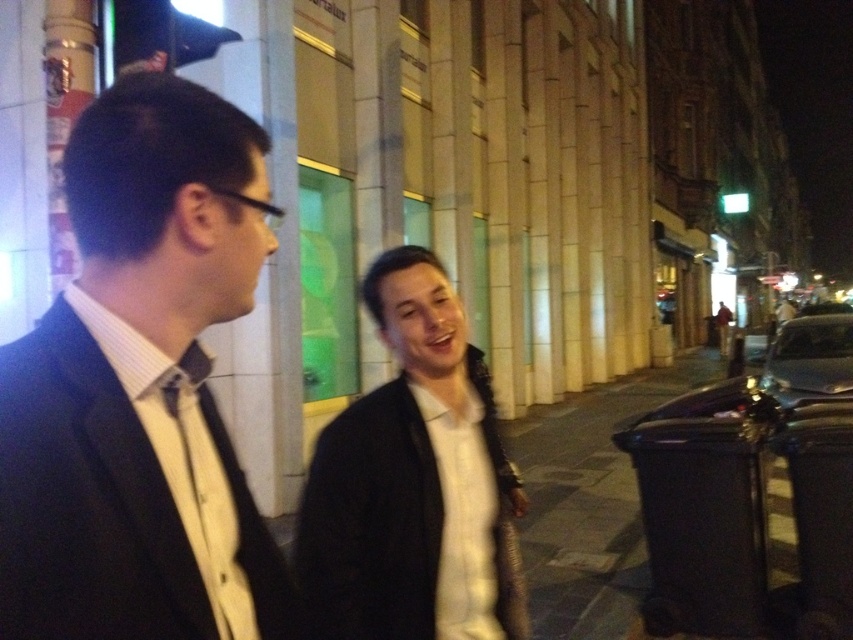
Can you confirm if black matte suit at left is thinner than matte black bow tie at center?

No, black matte suit at left is not thinner than matte black bow tie at center.

Is black matte suit at left to the left of matte black bow tie at center from the viewer's perspective?

Indeed, black matte suit at left is positioned on the left side of matte black bow tie at center.

Where is `black matte suit at left`? black matte suit at left is located at coordinates (180, 262).

Does black matte suit at left come in front of white matte jacket at center?

Yes.

Which is in front, point (51, 627) or point (492, 564)?

Point (51, 627)

Measure the distance between black matte suit at left and camera.

black matte suit at left and camera are 32.89 inches apart.

This screenshot has height=640, width=853. I want to click on black matte suit at left, so click(x=180, y=262).

Does white matte jacket at center appear under matte black bow tie at center?

Yes.

Who is positioned more to the right, white matte jacket at center or matte black bow tie at center?

Positioned to the right is white matte jacket at center.

Does point (401, 394) come closer to viewer compared to point (183, 385)?

That is False.

Identify the location of white matte jacket at center. The height and width of the screenshot is (640, 853). (399, 472).